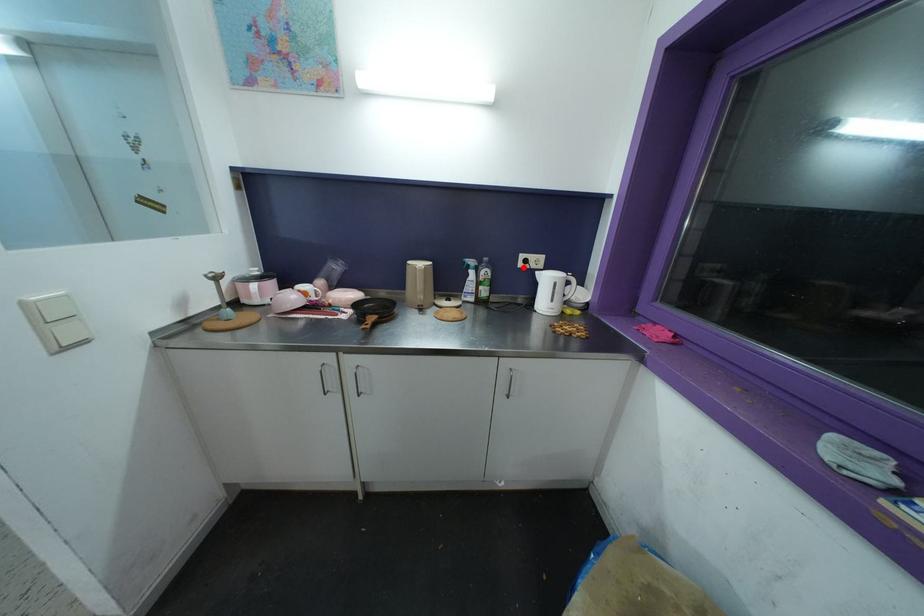
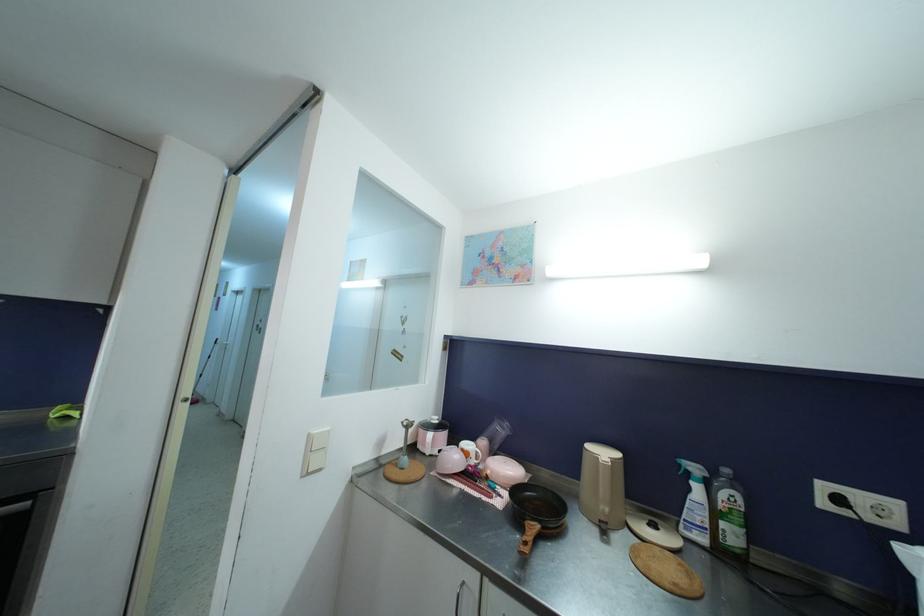
The point at the highlighted location is marked in the first image. Where is the corresponding point in the second image?

(827, 507)